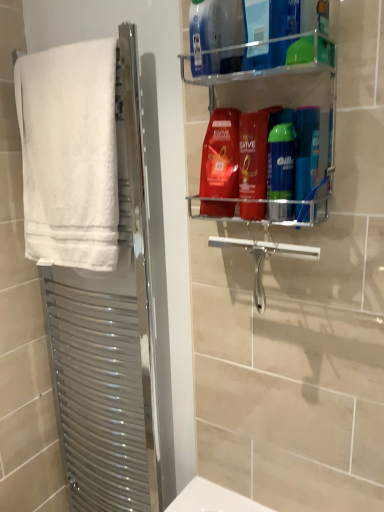
Question: Is blue plastic bottle at upper center, which is the third cleaning product in bottom-to-top order, aimed at silver metallic towel rack at left?

Choices:
 (A) yes
 (B) no

Answer: (B)

Question: Considering the relative positions of blue plastic bottle at upper center, which ranks as the first cleaning product in top-to-bottom order, and silver metallic towel rack at left in the image provided, is blue plastic bottle at upper center, which ranks as the first cleaning product in top-to-bottom order, to the right of silver metallic towel rack at left from the viewer's perspective?

Choices:
 (A) yes
 (B) no

Answer: (A)

Question: From a real-world perspective, is blue plastic bottle at upper center, which ranks as the first cleaning product in top-to-bottom order, located higher than silver metallic towel rack at left?

Choices:
 (A) yes
 (B) no

Answer: (A)

Question: Is blue plastic bottle at upper center, which is the third cleaning product in bottom-to-top order, thinner than silver metallic towel rack at left?

Choices:
 (A) yes
 (B) no

Answer: (A)

Question: Does blue plastic bottle at upper center, which is the third cleaning product in bottom-to-top order, come in front of silver metallic towel rack at left?

Choices:
 (A) yes
 (B) no

Answer: (A)

Question: Is blue plastic bottle at upper center, which is the third cleaning product in bottom-to-top order, directly adjacent to silver metallic towel rack at left?

Choices:
 (A) no
 (B) yes

Answer: (A)

Question: Considering the relative sizes of blue plastic bottle at upper center, which is the third cleaning product in bottom-to-top order, and white fluffy towel at left in the image provided, is blue plastic bottle at upper center, which is the third cleaning product in bottom-to-top order, shorter than white fluffy towel at left?

Choices:
 (A) yes
 (B) no

Answer: (A)

Question: Does blue plastic bottle at upper center, which ranks as the first cleaning product in top-to-bottom order, turn towards white fluffy towel at left?

Choices:
 (A) yes
 (B) no

Answer: (B)

Question: From the image's perspective, is blue plastic bottle at upper center, which is the third cleaning product in bottom-to-top order, under white fluffy towel at left?

Choices:
 (A) no
 (B) yes

Answer: (A)

Question: Is blue plastic bottle at upper center, which ranks as the first cleaning product in top-to-bottom order, wider than white fluffy towel at left?

Choices:
 (A) yes
 (B) no

Answer: (B)

Question: Does blue plastic bottle at upper center, which is the third cleaning product in bottom-to-top order, have a smaller size compared to white fluffy towel at left?

Choices:
 (A) yes
 (B) no

Answer: (A)

Question: From the image's perspective, does blue plastic bottle at upper center, which ranks as the first cleaning product in top-to-bottom order, appear higher than white fluffy towel at left?

Choices:
 (A) yes
 (B) no

Answer: (A)

Question: Considering the relative sizes of blue glossy shampoo at upper right, marked as the 2th toiletry in a left-to-right arrangement, and green glossy shaving cream can at center right, which ranks as the 1th toiletry in left-to-right order, in the image provided, is blue glossy shampoo at upper right, marked as the 2th toiletry in a left-to-right arrangement, thinner than green glossy shaving cream can at center right, which ranks as the 1th toiletry in left-to-right order,?

Choices:
 (A) yes
 (B) no

Answer: (B)